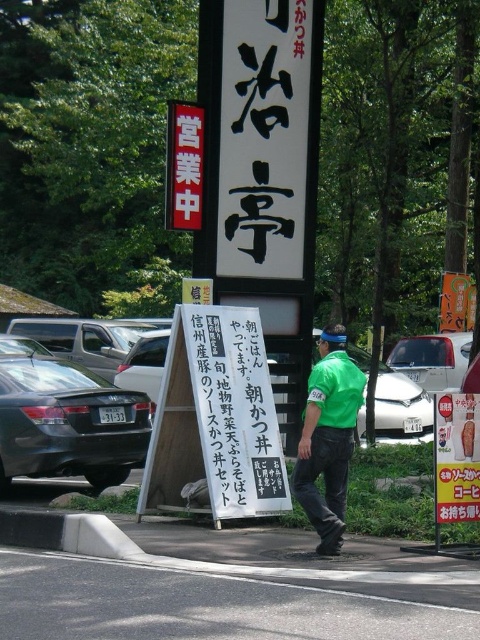
Question: Which point is closer to the camera taking this photo?

Choices:
 (A) (240, 426)
 (B) (308, 406)

Answer: (B)

Question: Can you confirm if black paper sign at center is wider than green fabric shirt at center?

Choices:
 (A) yes
 (B) no

Answer: (A)

Question: Can you confirm if black paper sign at center is smaller than green fabric shirt at center?

Choices:
 (A) no
 (B) yes

Answer: (A)

Question: Where is black paper sign at center located in relation to green fabric shirt at center in the image?

Choices:
 (A) above
 (B) below

Answer: (A)

Question: Which point is closer to the camera?

Choices:
 (A) green fabric shirt at center
 (B) black paper sign at center

Answer: (A)